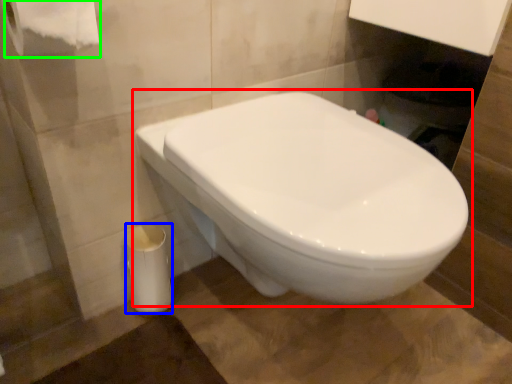
Question: Which is farther away from toilet (highlighted by a red box)? porcelain (highlighted by a blue box) or toilet paper (highlighted by a green box)?

Choices:
 (A) porcelain
 (B) toilet paper

Answer: (B)